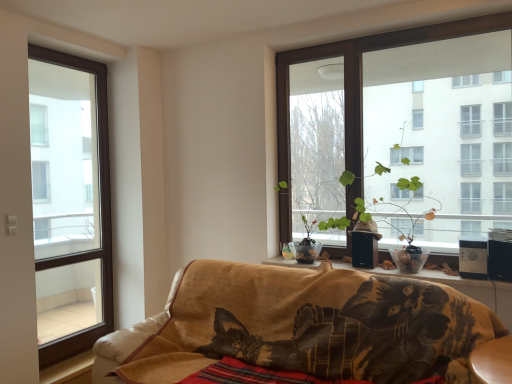
Where is `free space above brown wood window at left, which ranks as the 1th window in left-to-right order (from a real-world perspective)`? free space above brown wood window at left, which ranks as the 1th window in left-to-right order (from a real-world perspective) is located at coordinates (82, 57).